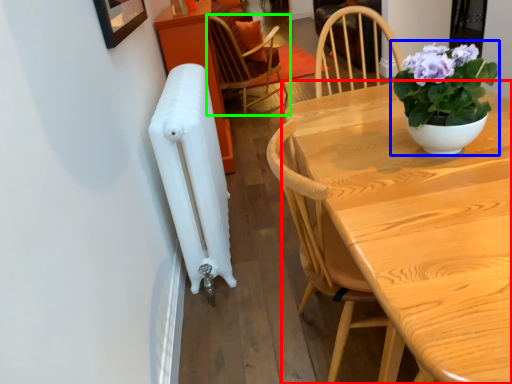
Question: Estimate the real-world distances between objects in this image. Which object is closer to table (highlighted by a red box), houseplant (highlighted by a blue box) or chair (highlighted by a green box)?

Choices:
 (A) houseplant
 (B) chair

Answer: (A)